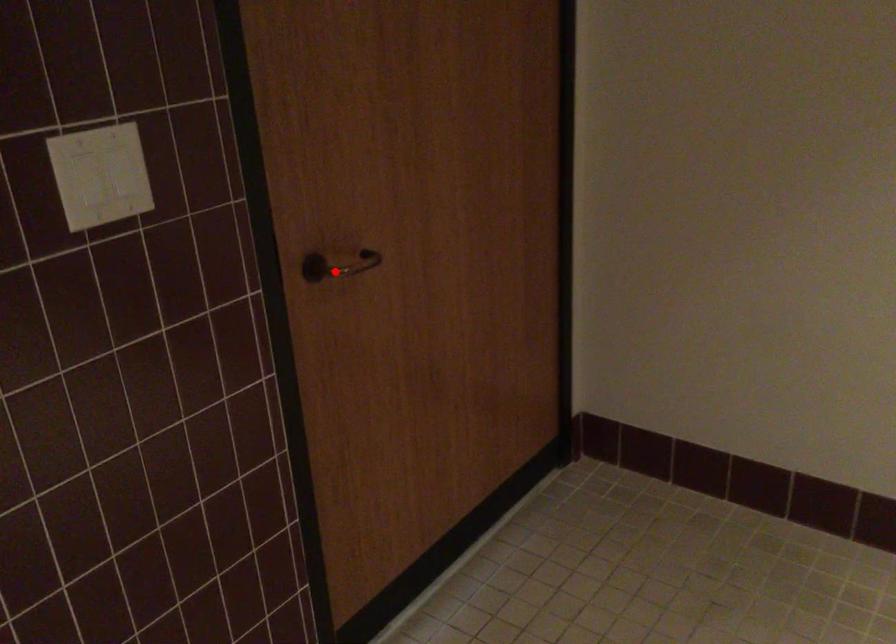
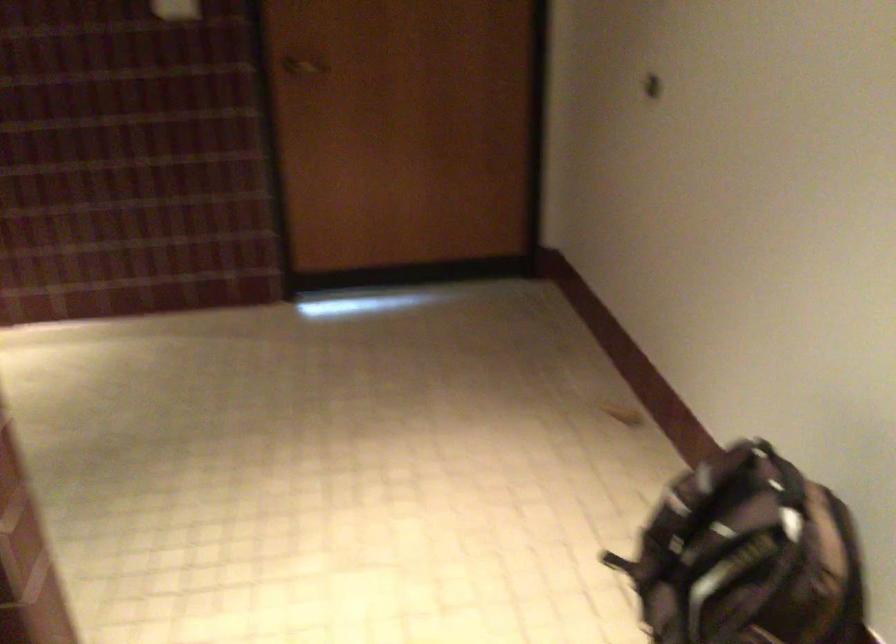
Question: A red point is marked in image1. In image2, is the corresponding 3D point closer to the camera or farther? Reply with the corresponding letter.

Choices:
 (A) The corresponding 3D point is closer.
 (B) The corresponding 3D point is farther.

Answer: (B)